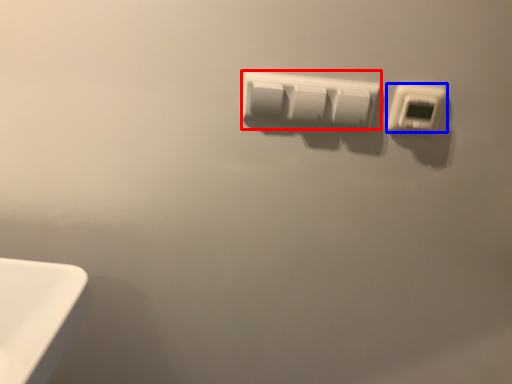
Question: Which object is further to the camera taking this photo, power plugs and sockets (highlighted by a red box) or power plugs and sockets (highlighted by a blue box)?

Choices:
 (A) power plugs and sockets
 (B) power plugs and sockets

Answer: (A)